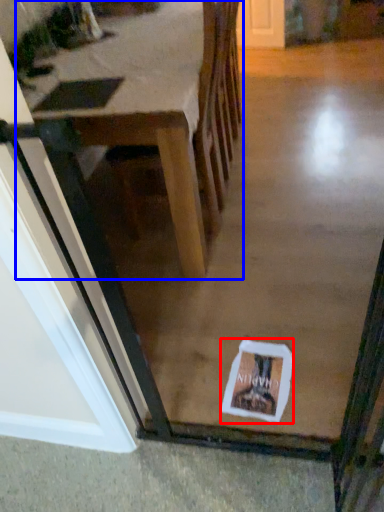
Question: Which object appears farthest to the camera in this image, postcard (highlighted by a red box) or table (highlighted by a blue box)?

Choices:
 (A) postcard
 (B) table

Answer: (A)